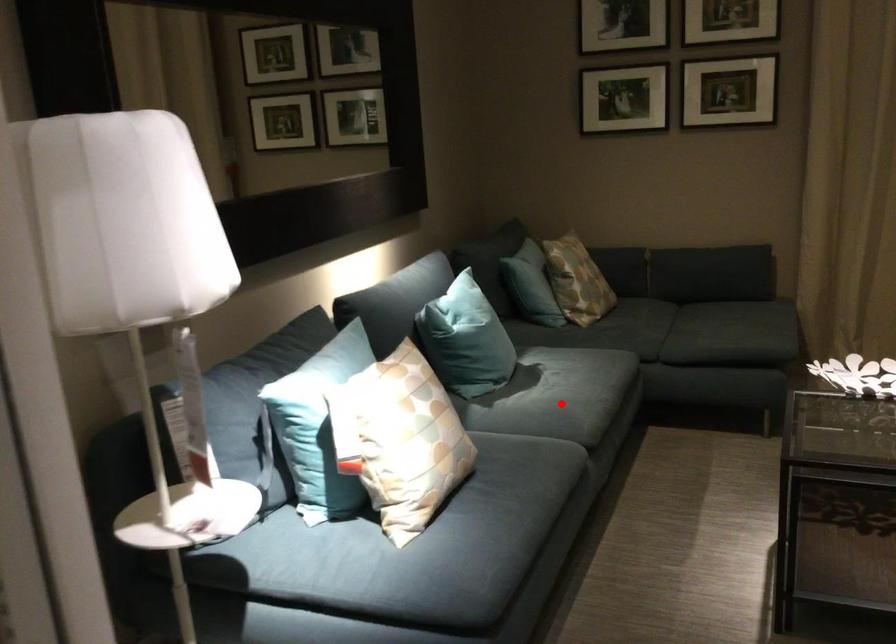
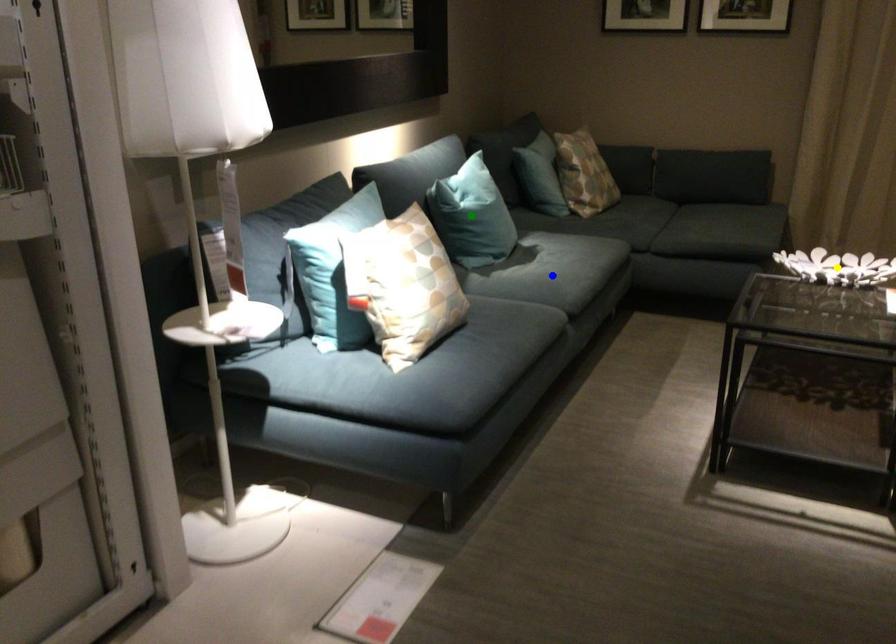
Question: I am providing you with two images of the same scene from different viewpoints. A red point is marked on the first image. You are given multiple points on the second image. In image 2, which mark is for the same physical point as the one in image 1?

Choices:
 (A) blue point
 (B) green point
 (C) yellow point

Answer: (A)